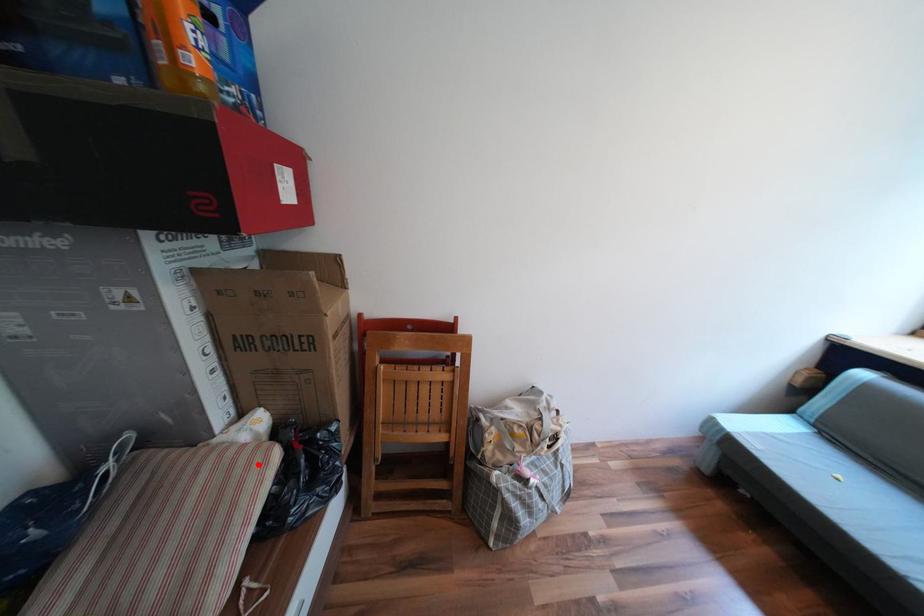
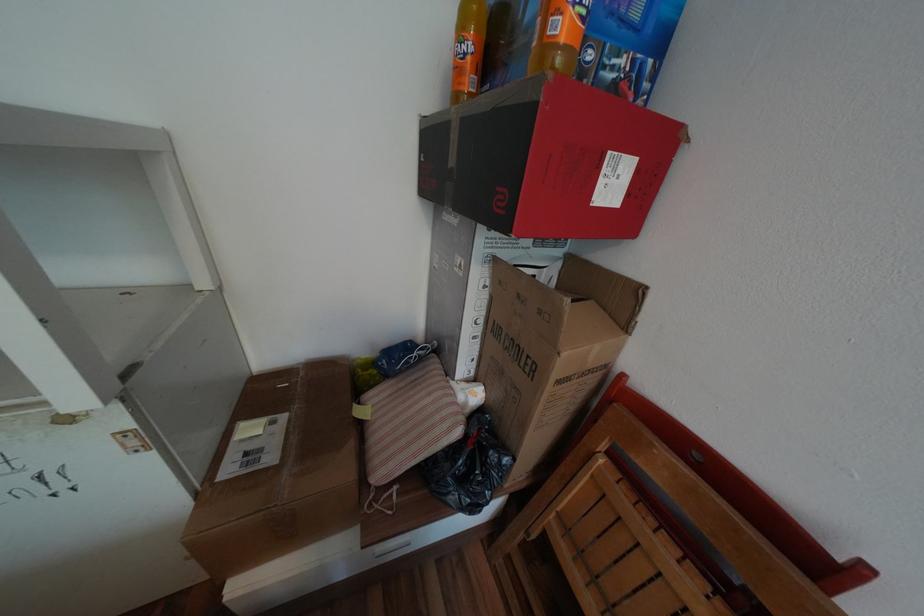
Where in the second image is the point corresponding to the highlighted location from the first image?

(453, 419)